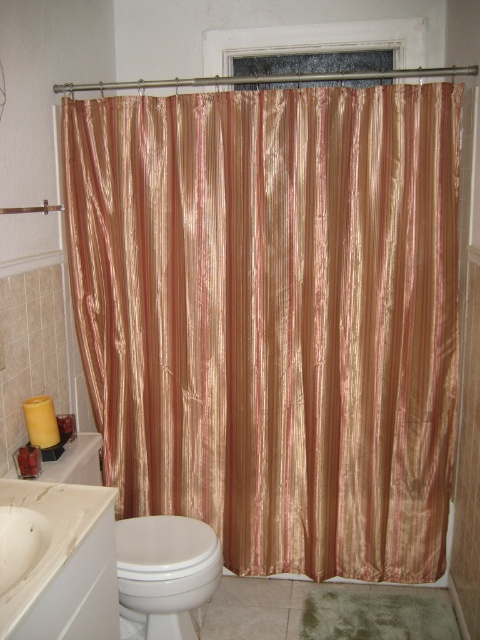
Question: Does shiny gold curtain at center have a lesser width compared to white glossy sink at lower left?

Choices:
 (A) yes
 (B) no

Answer: (B)

Question: Can you confirm if shiny gold curtain at center is thinner than white glossy toilet bowl at lower left?

Choices:
 (A) no
 (B) yes

Answer: (A)

Question: Estimate the real-world distances between objects in this image. Which object is farther from the white glossy sink at lower left?

Choices:
 (A) white glossy toilet bowl at lower left
 (B) shiny gold curtain at center

Answer: (B)

Question: Which object is the farthest from the white glossy toilet bowl at lower left?

Choices:
 (A) shiny gold curtain at center
 (B) white glossy sink at lower left

Answer: (A)

Question: Considering the real-world distances, which object is farthest from the shiny gold curtain at center?

Choices:
 (A) white glossy sink at lower left
 (B) white glossy toilet bowl at lower left

Answer: (A)

Question: Can you confirm if white glossy sink at lower left is positioned above white glossy toilet bowl at lower left?

Choices:
 (A) no
 (B) yes

Answer: (B)